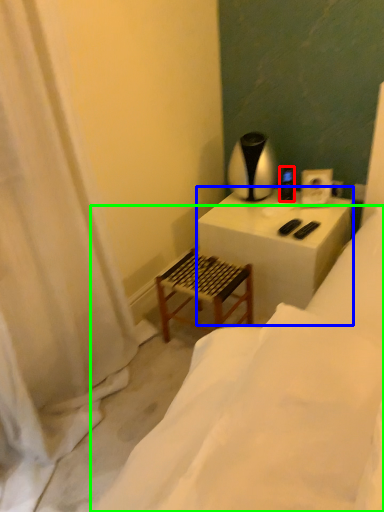
Question: Which object is positioned closest to appliance (highlighted by a red box)? Select from table (highlighted by a blue box) and furniture (highlighted by a green box).

Choices:
 (A) table
 (B) furniture

Answer: (A)